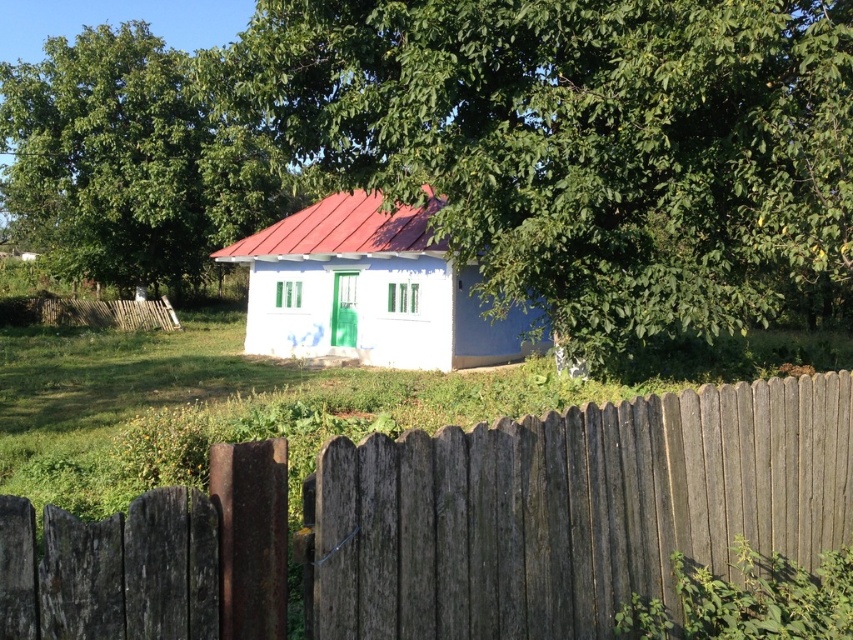
You are a delivery person trying to reach the white matte house at center. There is a weathered wood fence at center blocking the path. Can you walk through the fence?

The weathered wood fence at center might be wider than white matte house at center, but fences are typically solid barriers. You cannot walk through the fence regardless of its width.

What are the coordinates of the green leafy tree at center in the image?

The green leafy tree at center is located at coordinates point (579, 145).

You are standing in front of the white matte house at center and want to walk to the weathered wood fence at center. In which direction should you move?

You should move to the right because the weathered wood fence at center is to the right of the white matte house at center.